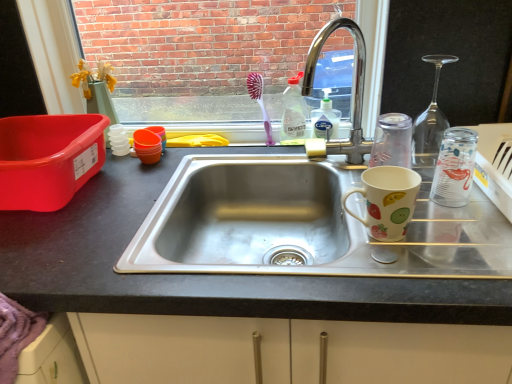
Question: Can you confirm if matte plastic container at left is thinner than pink plastic toothbrush at upper center?

Choices:
 (A) no
 (B) yes

Answer: (A)

Question: From the image's perspective, is matte plastic container at left on top of pink plastic toothbrush at upper center?

Choices:
 (A) yes
 (B) no

Answer: (B)

Question: Is matte plastic container at left facing away from pink plastic toothbrush at upper center?

Choices:
 (A) yes
 (B) no

Answer: (B)

Question: Is matte plastic container at left at the right side of pink plastic toothbrush at upper center?

Choices:
 (A) yes
 (B) no

Answer: (B)

Question: From a real-world perspective, is matte plastic container at left below pink plastic toothbrush at upper center?

Choices:
 (A) no
 (B) yes

Answer: (B)

Question: Is matte plastic container at left bigger than pink plastic toothbrush at upper center?

Choices:
 (A) no
 (B) yes

Answer: (B)

Question: Is chrome/metallic faucet at upper center positioned behind transparent glass bottle at right, marked as the 2th bottle in a top-to-bottom arrangement?

Choices:
 (A) yes
 (B) no

Answer: (B)

Question: Considering the relative sizes of chrome/metallic faucet at upper center and transparent glass bottle at right, which is counted as the second bottle, starting from the left, in the image provided, is chrome/metallic faucet at upper center shorter than transparent glass bottle at right, which is counted as the second bottle, starting from the left,?

Choices:
 (A) yes
 (B) no

Answer: (B)

Question: Could you tell me if chrome/metallic faucet at upper center is turned towards transparent glass bottle at right, marked as the first bottle in a bottom-to-top arrangement?

Choices:
 (A) yes
 (B) no

Answer: (B)

Question: Can you confirm if chrome/metallic faucet at upper center is taller than transparent glass bottle at right, which is counted as the second bottle, starting from the left?

Choices:
 (A) no
 (B) yes

Answer: (B)

Question: From the image's perspective, would you say chrome/metallic faucet at upper center is shown under transparent glass bottle at right, marked as the first bottle in a bottom-to-top arrangement?

Choices:
 (A) yes
 (B) no

Answer: (B)

Question: Is the surface of chrome/metallic faucet at upper center in direct contact with transparent glass bottle at right, which is the first bottle in front-to-back order?

Choices:
 (A) yes
 (B) no

Answer: (B)

Question: From a real-world perspective, is translucent plastic bottle at upper center, arranged as the 2th bottle when viewed from the right, on matte ceramic mug at right?

Choices:
 (A) yes
 (B) no

Answer: (A)